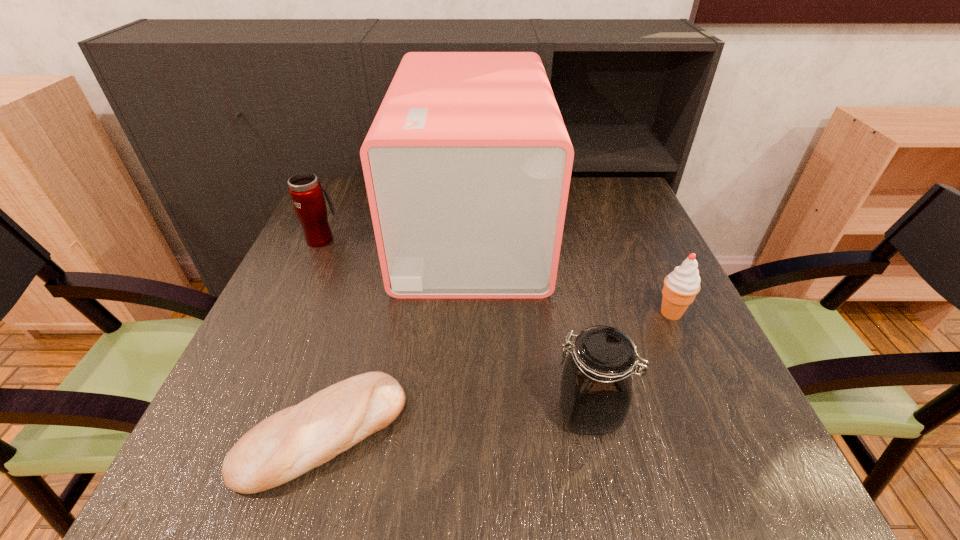
Identify the location of vacant area situated on the lid of the jar. This screenshot has height=540, width=960. (366, 412).

In order to click on free space located on the lid of the jar in this screenshot , I will do `click(384, 412)`.

Locate an element on the screen. Image resolution: width=960 pixels, height=540 pixels. free space located on the left of the icecream is located at coordinates (499, 313).

You are a GUI agent. You are given a task and a screenshot of the screen. Output one action in this format:
    pyautogui.click(x=<x>, y=<y>)
    Task: Click on the vacant space located on the back of the bread
    The width and height of the screenshot is (960, 540).
    Given the screenshot: What is the action you would take?
    pyautogui.click(x=374, y=257)

The image size is (960, 540). Identify the location of object located in the far edge section of the desktop. (467, 164).

At what (x,y) coordinates should I click in order to perform the action: click on object located at the near edge. Please return your answer as a coordinate pair (x, y). Looking at the image, I should click on (295, 440).

Identify the location of thermos bottle positioned at the left edge. (305, 190).

You are a GUI agent. You are given a task and a screenshot of the screen. Output one action in this format:
    pyautogui.click(x=<x>, y=<y>)
    Task: Click on the bread that is at the left edge
    Image resolution: width=960 pixels, height=540 pixels.
    Given the screenshot: What is the action you would take?
    pyautogui.click(x=295, y=440)

The height and width of the screenshot is (540, 960). I want to click on object present at the right edge, so tap(681, 286).

The image size is (960, 540). I want to click on object at the near left corner, so click(295, 440).